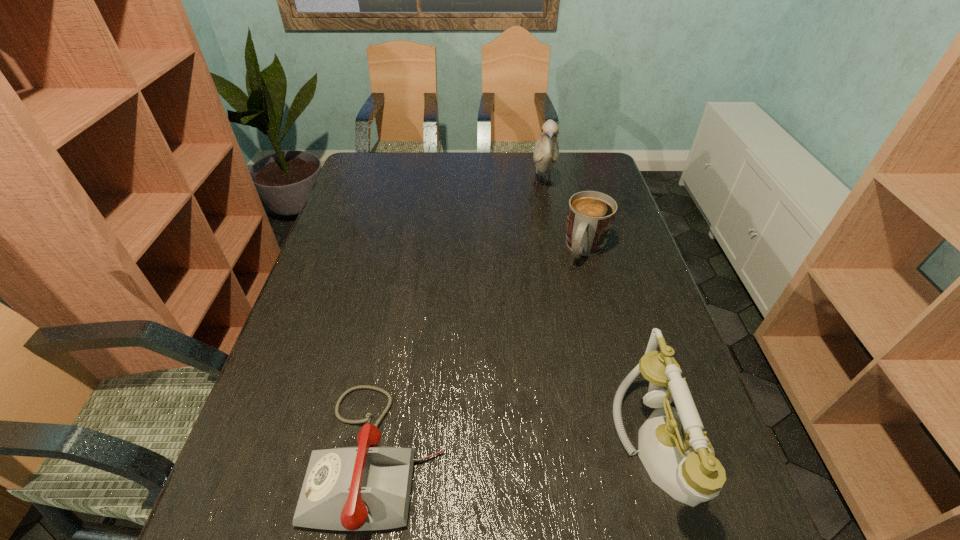
The image size is (960, 540). I want to click on vacant space located 0.200m at the beak of the bird, so click(547, 240).

The image size is (960, 540). Find the location of `vacant area situated 0.300m at the beak of the bird`. vacant area situated 0.300m at the beak of the bird is located at coordinates (548, 262).

Locate an element on the screen. This screenshot has height=540, width=960. object located in the far edge section of the desktop is located at coordinates (546, 153).

Identify the location of object that is at the near edge. (678, 456).

Where is `telephone present at the right edge`? telephone present at the right edge is located at coordinates [678, 456].

I want to click on mug at the right edge, so click(x=590, y=216).

The height and width of the screenshot is (540, 960). Find the location of `object that is at the near right corner`. object that is at the near right corner is located at coordinates (678, 456).

Find the location of `free space at the far edge of the desktop`. free space at the far edge of the desktop is located at coordinates (458, 185).

Locate an element on the screen. free space at the near edge of the desktop is located at coordinates (450, 475).

In the image, there is a desktop. Where is `vacant space at the left edge`? The image size is (960, 540). vacant space at the left edge is located at coordinates (331, 236).